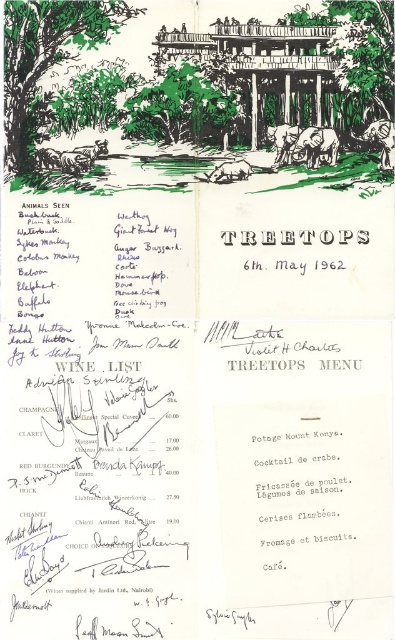
Based on the photo, you are a nature guide leading a tour in the Treetops area. You point to the image and ask your group to observe the green ink tree at upper left and the green leafy tree at center. Which tree appears closer to the viewer in the drawing?

The green ink tree at upper left appears closer to the viewer because it is positioned in front of the green leafy tree at center.

You are a park ranger measuring the distance between the green ink tree at upper left and the green leafy tree at center in the Treetops guestbook entry. The guestbook page is 8.5 inches wide. Can you fit both trees on a 6 inch ruler without overlapping?

The distance between the green ink tree at upper left and the green leafy tree at center is 4.98 inches. Since the ruler is 6 inches long, which is longer than the distance between them, both trees can be placed on the ruler without overlapping.